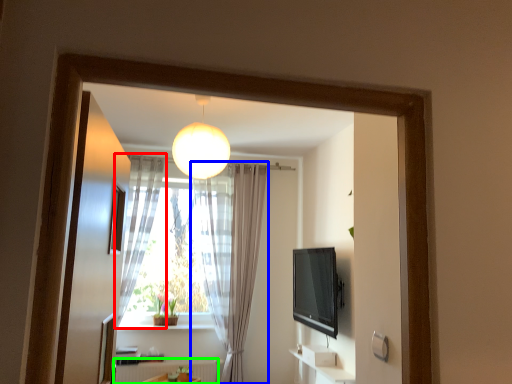
Question: Estimate the real-world distances between objects in this image. Which object is closer to curtain (highlighted by a red box), curtain (highlighted by a blue box) or radiator (highlighted by a green box)?

Choices:
 (A) curtain
 (B) radiator

Answer: (A)